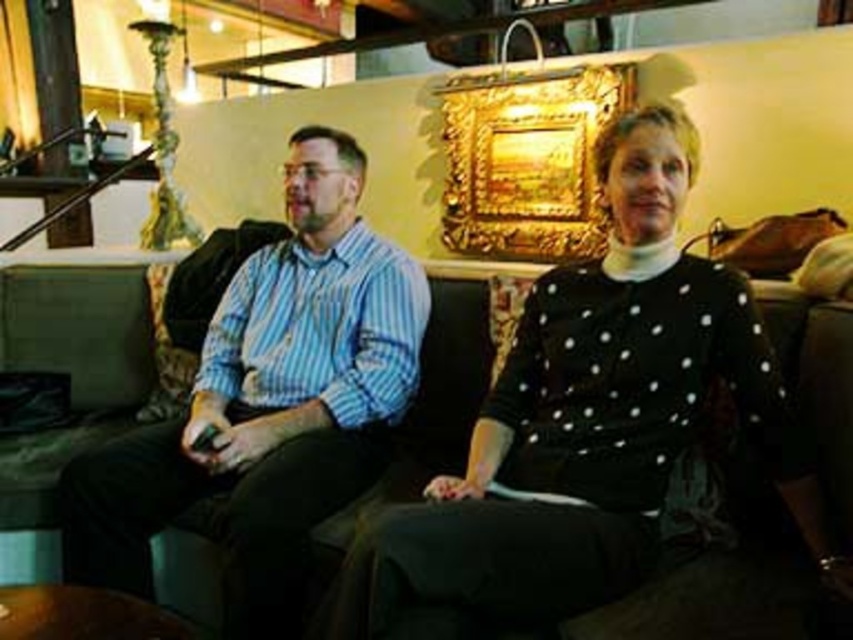
You are standing in the room and want to place a small decoration on the wall. You have two options for placement at coordinates point (421, 529) and point (195, 378). Which point is closer to your current position?

Point (421, 529) is closer to the camera than point (195, 378), so placing the decoration at point (421, 529) would be closer to your current position.

You are a photographer setting up a camera to capture a portrait of both individuals. The camera can only focus on subjects within a 30 cm width. Given the black dotted sweater at center and the blue striped shirt at left, which person might require more space due to their width?

The black dotted sweater at center might be wider than the blue striped shirt at left, so the person wearing the black dotted sweater at center might require more space due to their width.

You are standing in the room and want to locate the black dotted sweater at center. Can you describe its position relative to the staircase?

The black dotted sweater at center is located at coordinates (x=590, y=419). Since the staircase is mentioned to be on the left side of the background, the black dotted sweater at center is positioned to the right of the staircase.